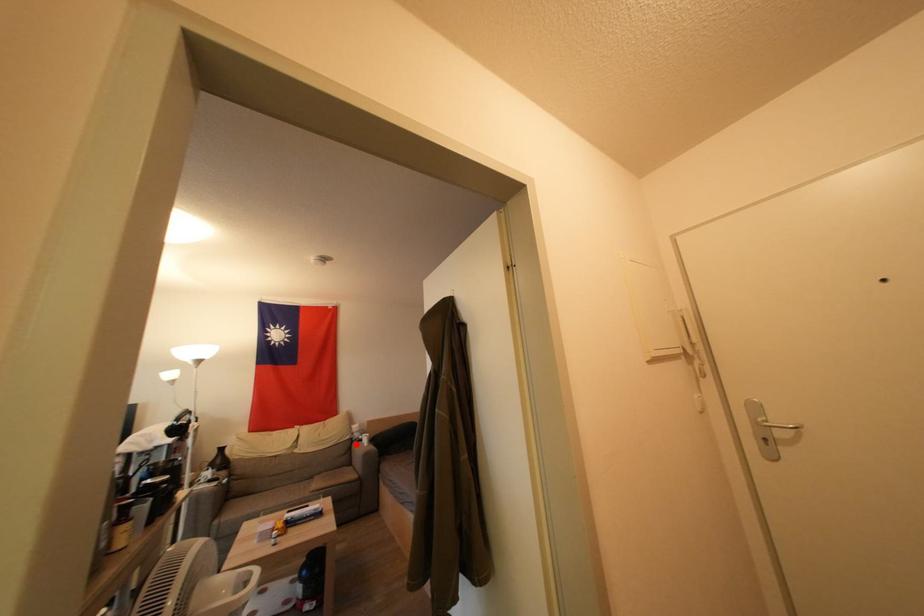
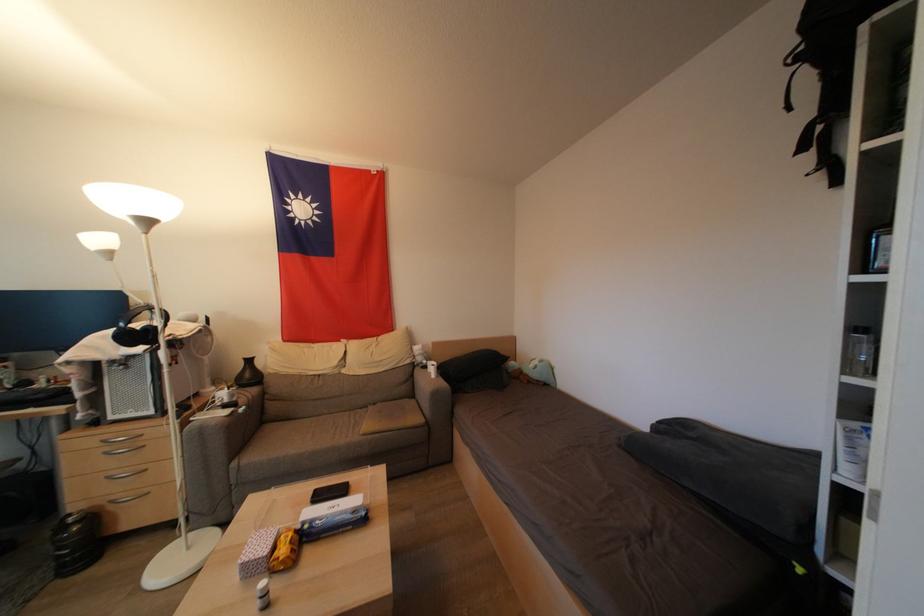
In the second image, find the point that corresponds to the highlighted location in the first image.

(418, 370)